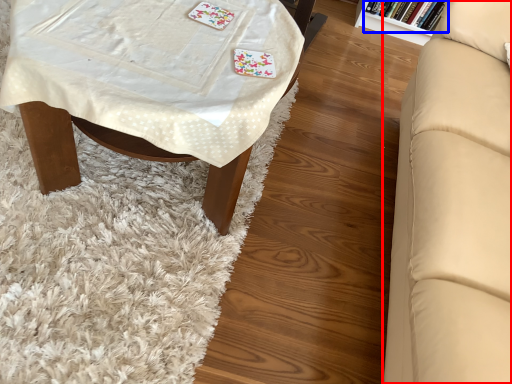
Question: Among these objects, which one is nearest to the camera, studio couch (highlighted by a red box) or book (highlighted by a blue box)?

Choices:
 (A) studio couch
 (B) book

Answer: (A)